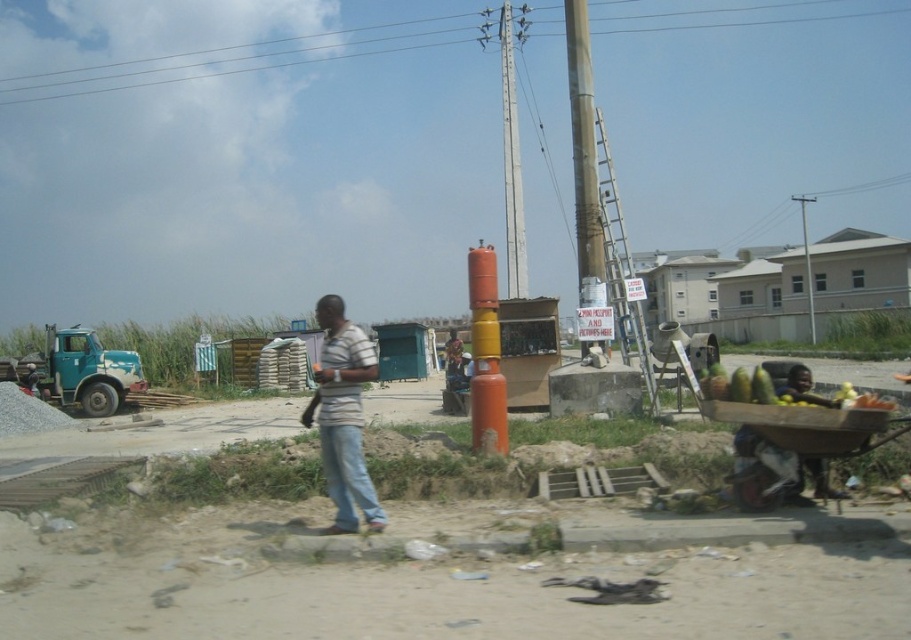
Question: Among these objects, which one is nearest to the camera?

Choices:
 (A) smooth metallic pole at center
 (B) white striped shirt at center
 (C) blue denim jeans at center

Answer: (B)

Question: Can you confirm if brushed metal power line at upper center is bigger than metallic gray telegraph pole at upper right?

Choices:
 (A) yes
 (B) no

Answer: (A)

Question: Which point is farther to the camera?

Choices:
 (A) (805, 291)
 (B) (323, 429)
 (C) (322, 58)

Answer: (C)

Question: Can you confirm if smooth metallic pole at center is bigger than blue denim jeans at center?

Choices:
 (A) yes
 (B) no

Answer: (A)

Question: Which of these objects is positioned closest to the smooth metallic pole at center?

Choices:
 (A) metallic gray telegraph pole at center
 (B) white striped shirt at center
 (C) metallic gray telegraph pole at upper right
 (D) blue denim jeans at center

Answer: (A)

Question: Is smooth metallic pole at center thinner than metallic gray telegraph pole at upper right?

Choices:
 (A) no
 (B) yes

Answer: (B)